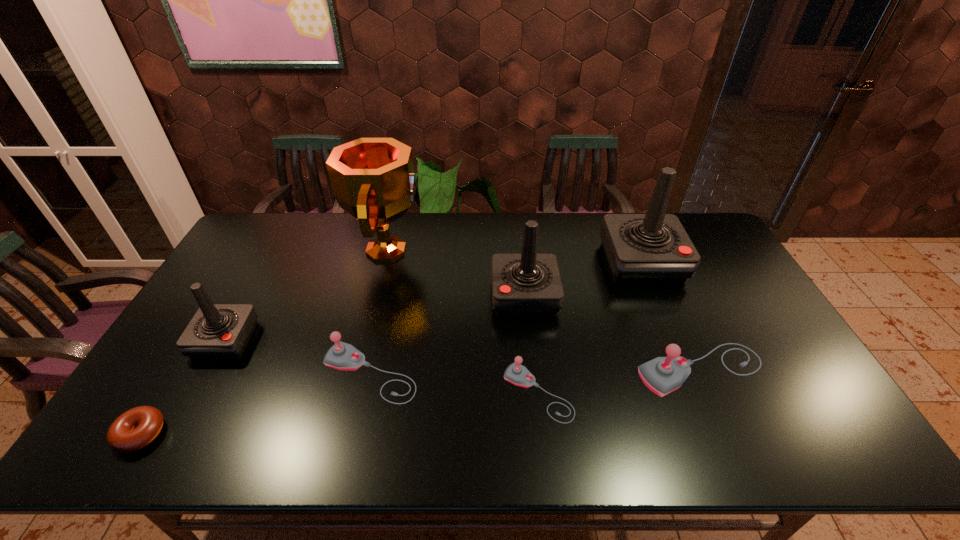
This screenshot has width=960, height=540. I want to click on vacant space in between the biggest gray joystick and the fourth shortest joystick, so click(463, 355).

Find the location of a particular element. Image resolution: width=960 pixels, height=540 pixels. free space that is in between the shortest joystick and the doughnut is located at coordinates (339, 413).

In order to click on vacant point located between the tallest joystick and the fourth shortest object in this screenshot , I will do `click(671, 316)`.

Point out which object is positioned as the fourth nearest to the gold award. Please provide its 2D coordinates. Your answer should be formatted as a tuple, i.e. [(x, y)], where the tuple contains the x and y coordinates of a point satisfying the conditions above.

[(517, 374)]

Identify which object is the third nearest to the gold award. Please provide its 2D coordinates. Your answer should be formatted as a tuple, i.e. [(x, y)], where the tuple contains the x and y coordinates of a point satisfying the conditions above.

[(217, 331)]

Find the location of a particular element. the fourth closest joystick relative to the biggest red joystick is located at coordinates (342, 356).

Locate which joystick ranks in proximity to the award. Please provide its 2D coordinates. Your answer should be formatted as a tuple, i.e. [(x, y)], where the tuple contains the x and y coordinates of a point satisfying the conditions above.

[(342, 356)]

Identify which red joystick is located as the second nearest to the third tallest joystick. Please provide its 2D coordinates. Your answer should be formatted as a tuple, i.e. [(x, y)], where the tuple contains the x and y coordinates of a point satisfying the conditions above.

[(653, 248)]

You are a GUI agent. You are given a task and a screenshot of the screen. Output one action in this format:
    pyautogui.click(x=<x>, y=<y>)
    Task: Click on the red joystick that stands as the closest to the leftmost joystick
    
    Given the screenshot: What is the action you would take?
    pyautogui.click(x=529, y=284)

The width and height of the screenshot is (960, 540). Identify the location of gray joystick identified as the third closest to the tallest joystick. (342, 356).